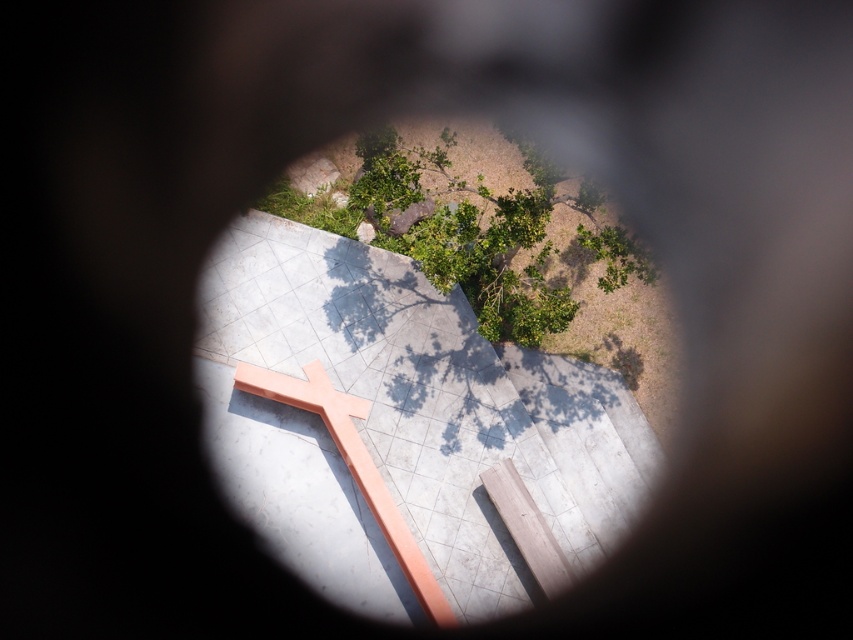
You are standing in the courtyard and want to take a photo of the peach wood cross at center. To ensure the green leafy tree at upper center doesn not block the cross in the photo, should you move closer to or farther away from the cross?

The green leafy tree at upper center is larger in size than the peach wood cross at center. To prevent the tree from blocking the cross, you should move farther away from the cross. This will make both the tree and the cross appear smaller in the frame, but the tree will still be larger. Wait, that might not be correct. Let me think again. If the tree is already larger, moving back would make both smaller, but the tree would still be proportionally larger. Alternatively, moving closer would make the cross l

You are planning to install a new light fixture between the green leafy tree at upper center and the peach wood cross at center. The manufacturer recommends a minimum distance of 5 feet between the light and any nearby objects for safety. Based on the scene description, is this spacing requirement met?

The distance between the green leafy tree at upper center and the peach wood cross at center is 7.67 feet, which exceeds the recommended 5 feet minimum. Therefore, the spacing requirement is met.

You are standing in the courtyard and want to take a photo of the peach wood cross at center without the green leafy tree at upper center blocking it. Which direction should you move to ensure the tree is out of the frame?

Move downward or to the lower part of the courtyard so that the peach wood cross at center remains in view while the green leafy tree at upper center moves out of the frame since it is positioned above the cross.